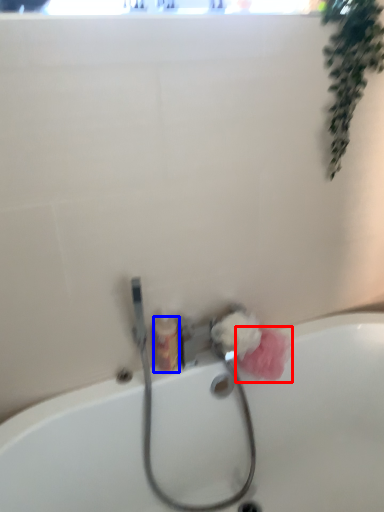
Question: Which point is closer to the camera, flower (highlighted by a red box) or toiletry (highlighted by a blue box)?

Choices:
 (A) flower
 (B) toiletry

Answer: (B)